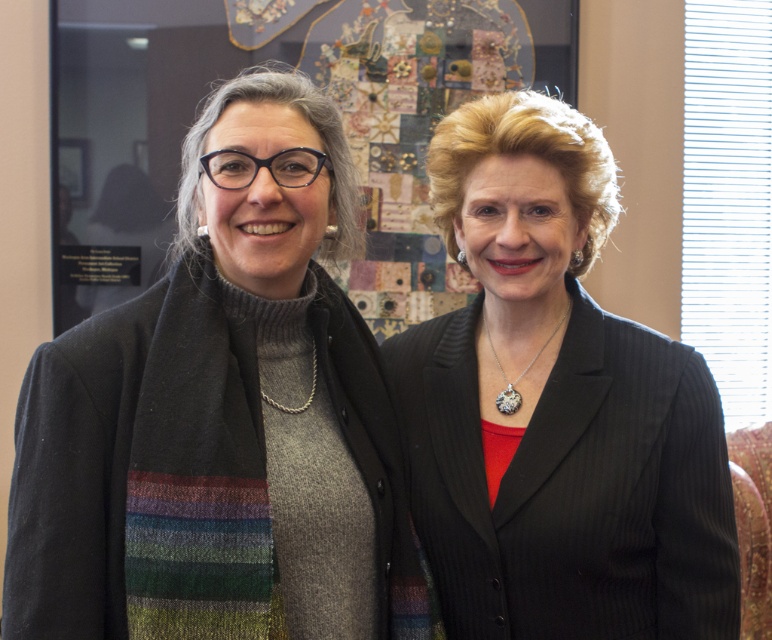
Can you confirm if knitted scarf at center is positioned below black pinstripe suit at center?

No.

Between point (340, 374) and point (613, 330), which one is positioned behind?

The point (613, 330) is behind.

This screenshot has width=772, height=640. What do you see at coordinates (222, 419) in the screenshot?
I see `knitted scarf at center` at bounding box center [222, 419].

The width and height of the screenshot is (772, 640). Find the location of `knitted scarf at center`. knitted scarf at center is located at coordinates (222, 419).